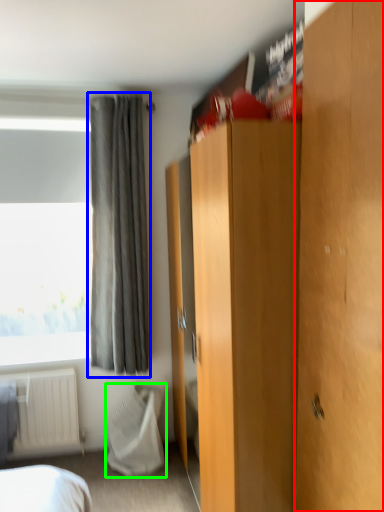
Question: Considering the real-world distances, which object is farthest from door (highlighted by a red box)? curtain (highlighted by a blue box) or blanket (highlighted by a green box)?

Choices:
 (A) curtain
 (B) blanket

Answer: (B)